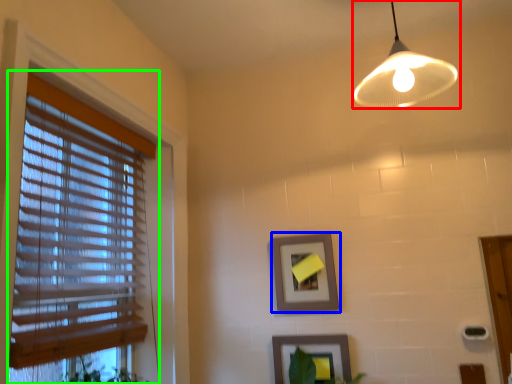
Question: Based on their relative distances, which object is farther from lamp (highlighted by a red box)? Choose from picture frame (highlighted by a blue box) and window blind (highlighted by a green box).

Choices:
 (A) picture frame
 (B) window blind

Answer: (B)